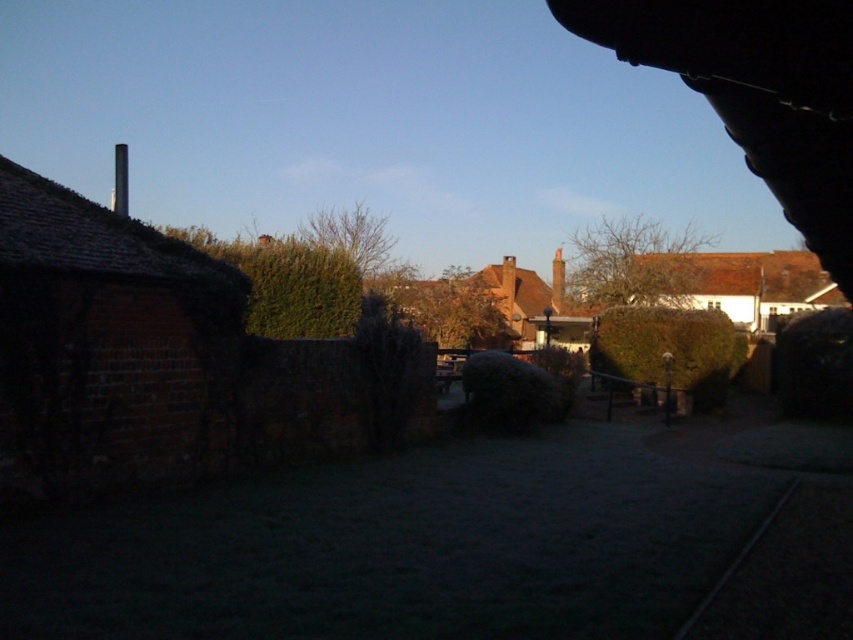
Question: Among these objects, which one is farthest from the camera?

Choices:
 (A) orange clay chimney at center
 (B) smooth white chimney at upper left
 (C) smooth brick chimney at center
 (D) black metal train track at lower right

Answer: (A)

Question: Is smooth white chimney at upper left positioned before orange clay chimney at center?

Choices:
 (A) yes
 (B) no

Answer: (A)

Question: Among these points, which one is nearest to the camera?

Choices:
 (A) (766, 522)
 (B) (122, 180)
 (C) (556, 269)
 (D) (506, 266)

Answer: (A)

Question: Which point is farther from the camera taking this photo?

Choices:
 (A) (125, 202)
 (B) (515, 276)
 (C) (558, 256)

Answer: (C)

Question: Is orange clay chimney at center to the right of smooth brick chimney at center from the viewer's perspective?

Choices:
 (A) yes
 (B) no

Answer: (B)

Question: Is black metal train track at lower right in front of smooth brick chimney at center?

Choices:
 (A) no
 (B) yes

Answer: (B)